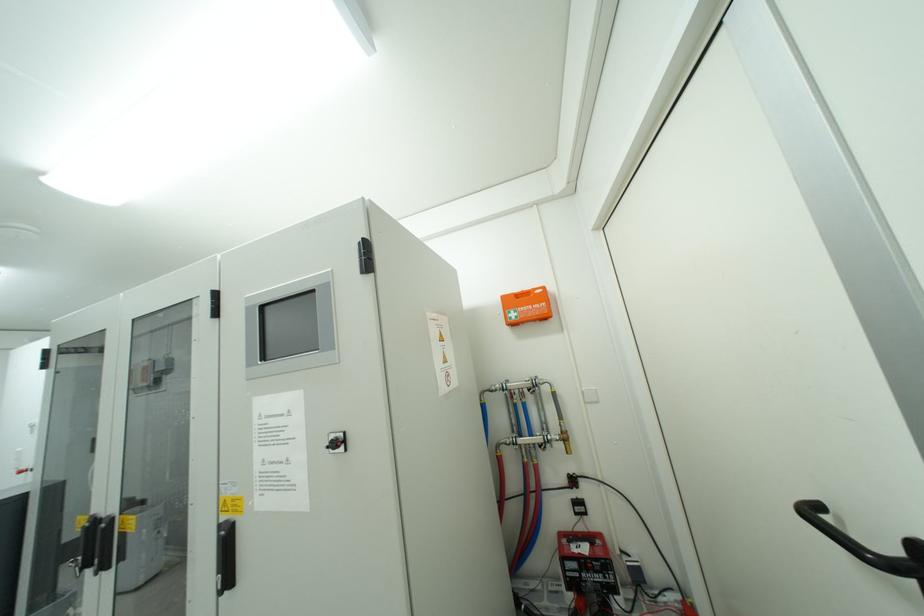
The image size is (924, 616). Describe the element at coordinates (867, 544) in the screenshot. I see `the blue valve handle` at that location.